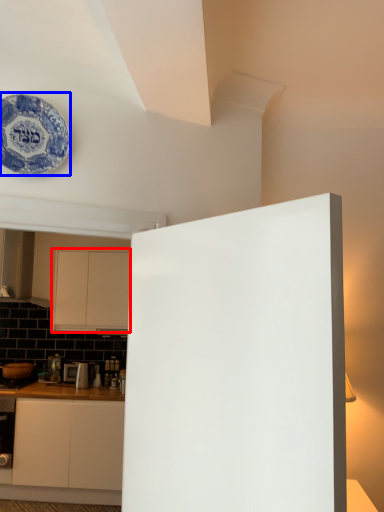
Question: Which object appears closest to the camera in this image, cabinetry (highlighted by a red box) or plate (highlighted by a blue box)?

Choices:
 (A) cabinetry
 (B) plate

Answer: (B)